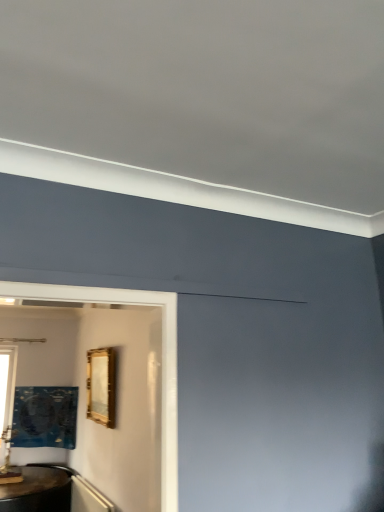
Question: Is clear glass window at left closer to the viewer compared to gold metallic picture frame at center, acting as the first picture frame starting from the right?

Choices:
 (A) no
 (B) yes

Answer: (A)

Question: Is clear glass window at left taller than gold metallic picture frame at center, which appears as the 2th picture frame when viewed from the left?

Choices:
 (A) yes
 (B) no

Answer: (A)

Question: Is clear glass window at left outside gold metallic picture frame at center, acting as the first picture frame starting from the right?

Choices:
 (A) no
 (B) yes

Answer: (B)

Question: Can you confirm if clear glass window at left is shorter than gold metallic picture frame at center, placed as the 2th picture frame when sorted from back to front?

Choices:
 (A) yes
 (B) no

Answer: (B)

Question: Is clear glass window at left with gold metallic picture frame at center, acting as the first picture frame starting from the right?

Choices:
 (A) no
 (B) yes

Answer: (A)

Question: From the image's perspective, is metallic gold picture frame at lower left, the 1th picture frame in the left-to-right sequence, positioned above or below clear glass window at left?

Choices:
 (A) above
 (B) below

Answer: (B)

Question: Is point (46, 387) closer or farther from the camera than point (3, 378)?

Choices:
 (A) closer
 (B) farther

Answer: (B)

Question: In terms of size, does metallic gold picture frame at lower left, the 1th picture frame from the bottom, appear bigger or smaller than clear glass window at left?

Choices:
 (A) big
 (B) small

Answer: (A)

Question: Considering the positions of metallic gold picture frame at lower left, the 1th picture frame from the bottom, and clear glass window at left in the image, is metallic gold picture frame at lower left, the 1th picture frame from the bottom, taller or shorter than clear glass window at left?

Choices:
 (A) tall
 (B) short

Answer: (B)

Question: From their relative heights in the image, would you say clear glass window at left is taller or shorter than metallic gold picture frame at lower left, positioned as the second picture frame in right-to-left order?

Choices:
 (A) tall
 (B) short

Answer: (A)

Question: From a real-world perspective, is clear glass window at left physically located above or below metallic gold picture frame at lower left, the 1th picture frame from the bottom?

Choices:
 (A) below
 (B) above

Answer: (B)

Question: Does point (13, 365) appear closer or farther from the camera than point (18, 421)?

Choices:
 (A) closer
 (B) farther

Answer: (B)

Question: Is clear glass window at left to the left or to the right of metallic gold picture frame at lower left, the 1th picture frame from the bottom, in the image?

Choices:
 (A) left
 (B) right

Answer: (A)

Question: Which is correct: gold metallic picture frame at center, the first picture frame positioned from the front, is inside metallic gold picture frame at lower left, which appears as the 1th picture frame when viewed from the back, or outside of it?

Choices:
 (A) inside
 (B) outside

Answer: (B)

Question: From the image's perspective, is gold metallic picture frame at center, which appears as the 2th picture frame when viewed from the left, located above or below metallic gold picture frame at lower left, which is the 2th picture frame in top-to-bottom order?

Choices:
 (A) below
 (B) above

Answer: (B)